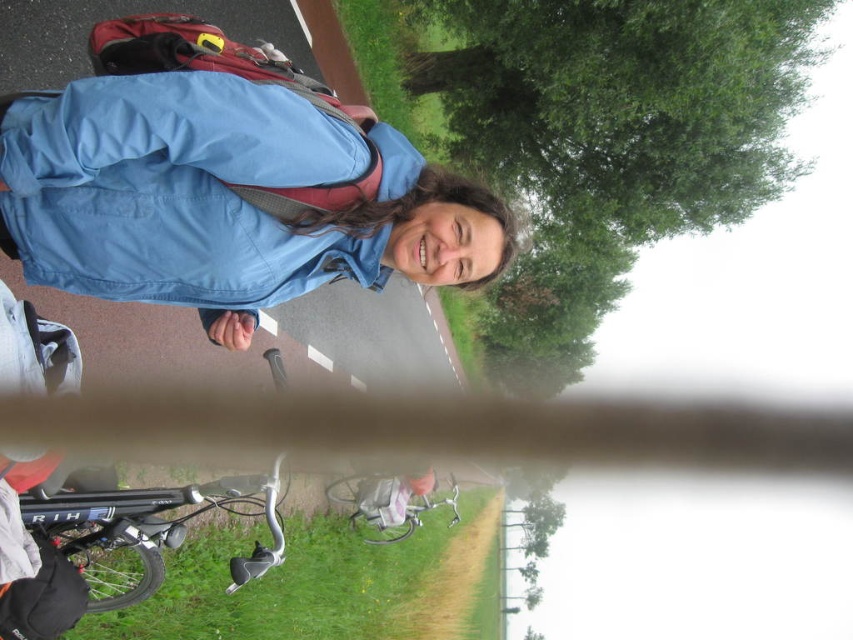
You are planning to take a photo of the shiny black bicycle handlebars at lower left and the metallic silver bicycle at lower center. Since the image is rotated, you need to adjust your camera angle. Considering their heights, which bicycle part should you look down at to capture both in the frame?

You should look down at the shiny black bicycle handlebars at lower left because it is shorter than the metallic silver bicycle at lower center, allowing both to be captured in the frame when adjusting the camera angle.

You are a photographer trying to capture the scene. You notice the blue fabric jacket at center and the shiny black bicycle handlebars at lower left. Which object takes up more area in the photo?

The shiny black bicycle handlebars at lower left take up more area in the photo because the blue fabric jacket at center occupies less space than them.

You are standing at the center of the image. Which object is located at point (144,528)?

The shiny black bicycle handlebars at lower left is located at point (144,528).